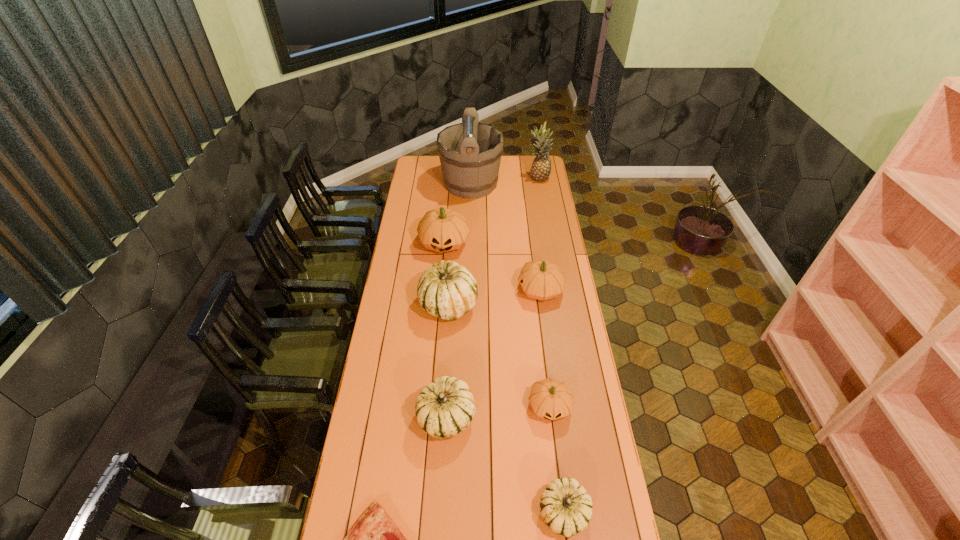
The height and width of the screenshot is (540, 960). I want to click on object that is positioned at the far right corner, so click(541, 166).

What are the coordinates of `vacant point at the far edge` in the screenshot? It's located at [440, 175].

At what (x,y) coordinates should I click in order to perform the action: click on free location at the left edge of the desktop. Please return your answer as a coordinate pair (x, y). The width and height of the screenshot is (960, 540). Looking at the image, I should click on (428, 198).

The image size is (960, 540). I want to click on vacant space at the right edge of the desktop, so click(544, 205).

Find the location of a particular element. The height and width of the screenshot is (540, 960). vacant region at the far left corner of the desktop is located at coordinates (415, 158).

What are the coordinates of `free space between the nearest orange gourd and the biggest white gourd` in the screenshot? It's located at (498, 355).

This screenshot has width=960, height=540. In order to click on vacant space that's between the biggest white gourd and the smallest orange gourd in this screenshot , I will do `click(498, 355)`.

You are a GUI agent. You are given a task and a screenshot of the screen. Output one action in this format:
    pyautogui.click(x=<x>, y=<y>)
    Task: Click on the free spot between the farthest white gourd and the green pineapple
    
    Given the screenshot: What is the action you would take?
    pyautogui.click(x=493, y=241)

Identify the location of blank region between the farthest orange gourd and the smallest orange gourd. (497, 325).

This screenshot has width=960, height=540. Find the location of `unoccupied area between the smallest orange gourd and the seventh nearest object`. unoccupied area between the smallest orange gourd and the seventh nearest object is located at coordinates (497, 325).